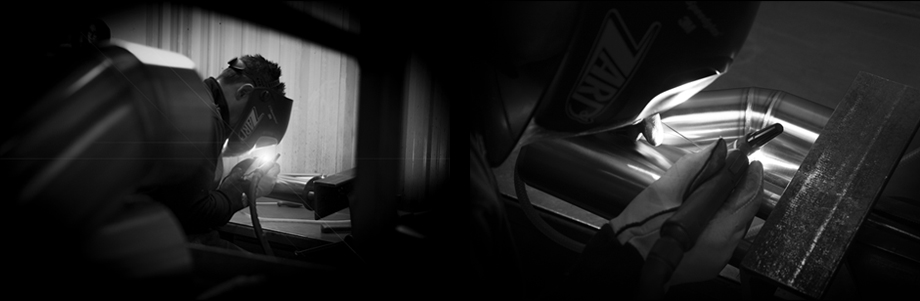
The image size is (920, 301). Identify the location of wall. (327, 84).